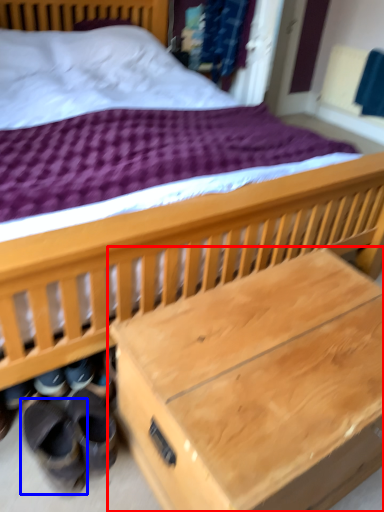
Question: Which object appears farthest to the camera in this image, table (highlighted by a red box) or footwear (highlighted by a blue box)?

Choices:
 (A) table
 (B) footwear

Answer: (B)